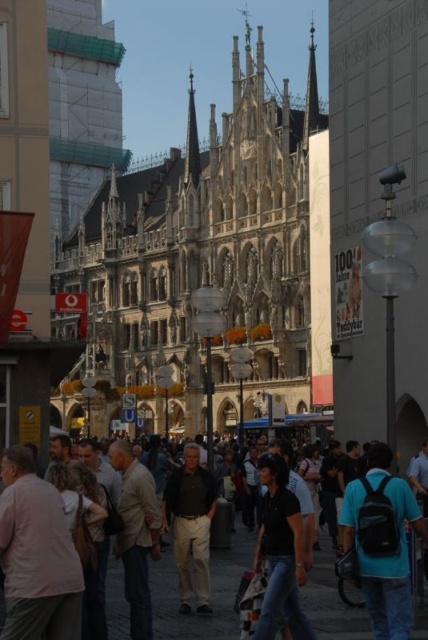
Question: Which of the following is the closest to the observer?

Choices:
 (A) (12, 513)
 (B) (211, 634)
 (C) (278, 516)

Answer: (A)

Question: Based on their relative distances, which object is nearer to the dark gray shirt at center?

Choices:
 (A) black cotton shirt at center
 (B) light beige jacket at center
 (C) stone gothic church at center
 (D) teal backpack at center

Answer: (B)

Question: Is black cotton shirt at center to the left of light beige jacket at center from the viewer's perspective?

Choices:
 (A) yes
 (B) no

Answer: (B)

Question: Which point is closer to the camera taking this photo?

Choices:
 (A) (187, 628)
 (B) (291, 212)

Answer: (A)

Question: Does stone gothic church at center appear on the right side of light pink shirt at center?

Choices:
 (A) yes
 (B) no

Answer: (B)

Question: Can you confirm if stone gothic church at center is smaller than teal backpack at center?

Choices:
 (A) yes
 (B) no

Answer: (B)